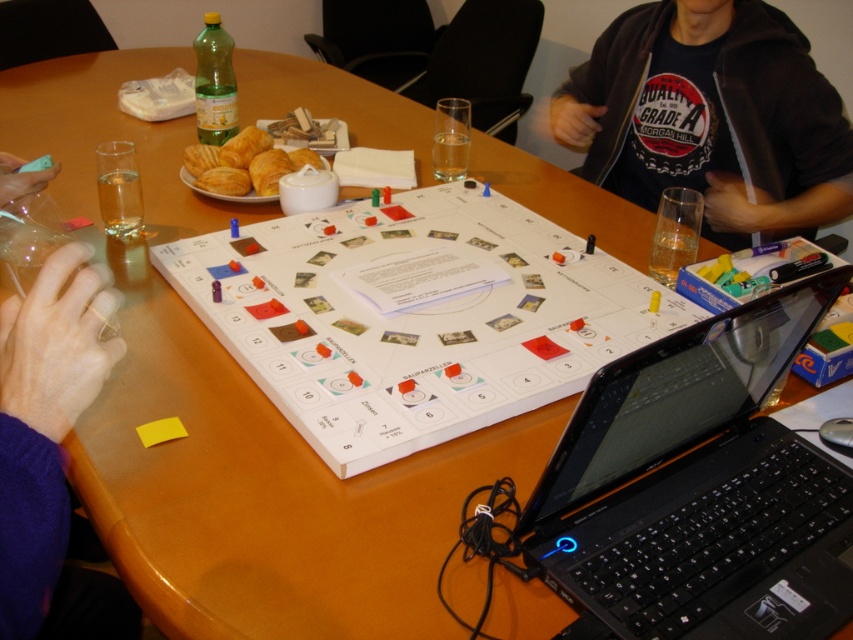
Does black plastic laptop at lower right have a larger size compared to golden flaky croissant at center?

Yes.

Can you confirm if black plastic laptop at lower right is positioned to the right of golden flaky croissant at center?

Yes, black plastic laptop at lower right is to the right of golden flaky croissant at center.

Does point (601, 483) lie behind point (271, 188)?

No, it is not.

Locate an element on the screen. This screenshot has width=853, height=640. black plastic laptop at lower right is located at coordinates (699, 488).

Which of these two, black cotton shirt at upper center or purple fabric hand at lower left, stands taller?

With more height is black cotton shirt at upper center.

Does black cotton shirt at upper center have a lesser width compared to purple fabric hand at lower left?

Incorrect, black cotton shirt at upper center's width is not less than purple fabric hand at lower left's.

Identify the location of black cotton shirt at upper center. This screenshot has width=853, height=640. (711, 116).

Can you confirm if black cotton shirt at upper center is thinner than golden flaky croissant at center?

In fact, black cotton shirt at upper center might be wider than golden flaky croissant at center.

Is black cotton shirt at upper center shorter than golden flaky croissant at center?

No, black cotton shirt at upper center is not shorter than golden flaky croissant at center.

I want to click on black cotton shirt at upper center, so click(x=711, y=116).